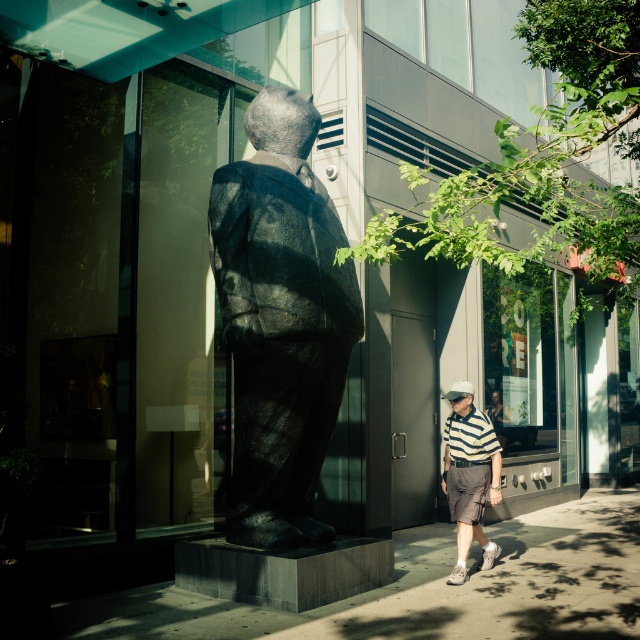
You are standing at the entrance of the modern building and want to take a photo of the black textured statue at center without the striped cotton polo shirt at center appearing in the frame. Is this possible given their positions?

The black textured statue at center is in front of the striped cotton polo shirt at center, so if you position yourself behind the statue, the statue will block the striped cotton polo shirt at center, allowing you to take a photo of the statue without the shirt appearing in the frame.

You are standing at point (468,474) in the urban scene. What object is located exactly at this coordinate?

The striped cotton polo shirt at center is located exactly at point (468,474).

You are a delivery person trying to navigate through the area. You need to move your cart from the left side of the black textured statue at center to the right side. Is there enough space between the statue and the concrete sidewalk at center to maneuver your cart?

The black textured statue at center has a lesser width compared to the concrete sidewalk at center, so there is enough space to maneuver the cart between them.